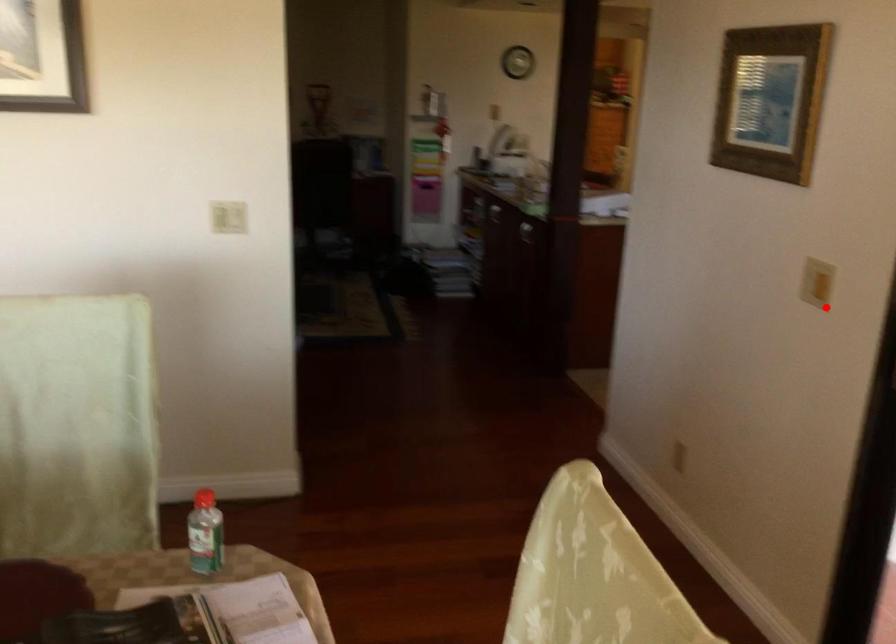
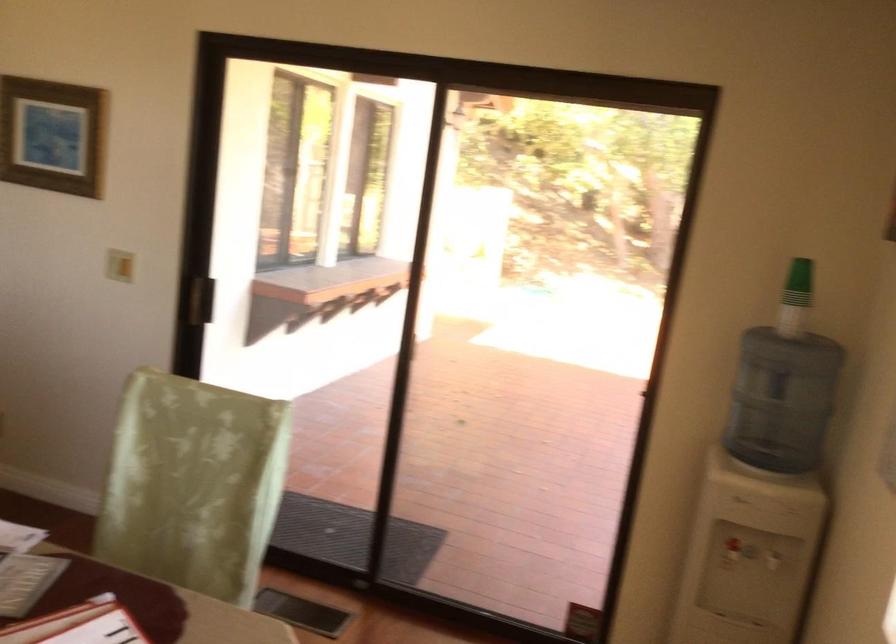
Question: I am providing you with two images of the same scene from different viewpoints. Image1 has a red point marked. In image2, the corresponding 3D location appears at what relative position? Reply with the corresponding letter.

Choices:
 (A) Closer
 (B) Farther

Answer: (B)